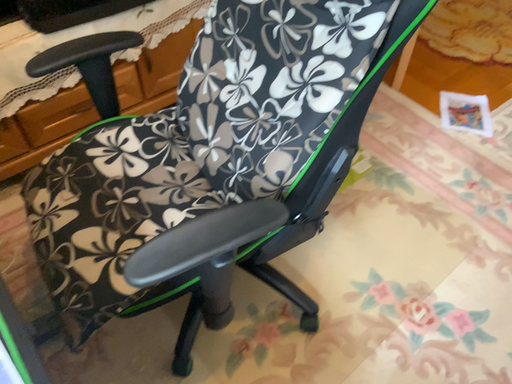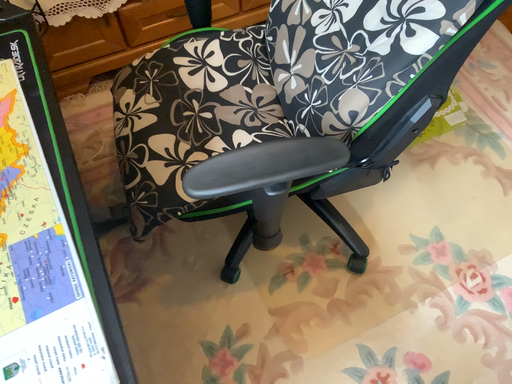
Question: Which way did the camera rotate in the video?

Choices:
 (A) rotated left
 (B) rotated right

Answer: (A)